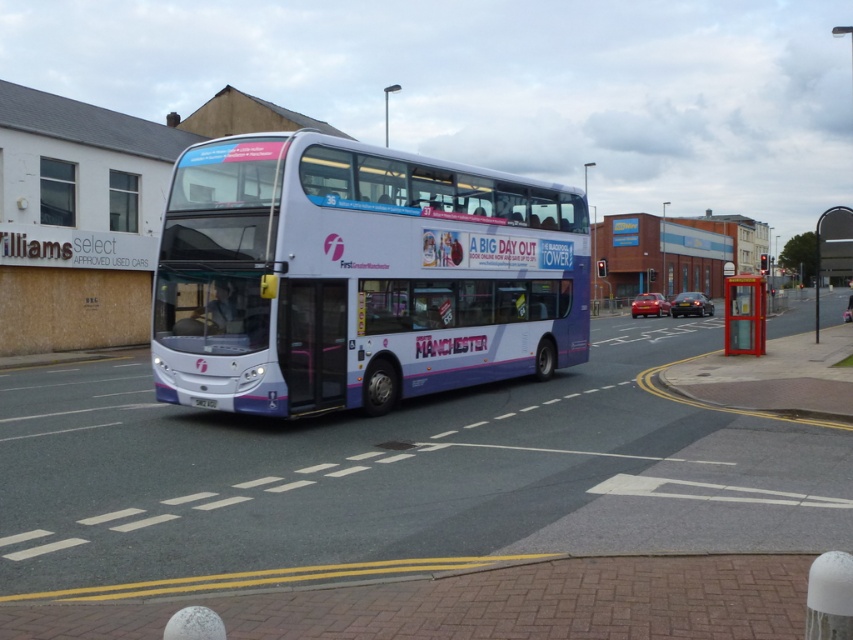
Is white glossy bus at center wider than metallic bus stop at right?

No, white glossy bus at center is not wider than metallic bus stop at right.

Between point (167, 195) and point (849, 236), which one is positioned in front?

Point (167, 195) is in front.

This screenshot has width=853, height=640. In order to click on white glossy bus at center in this screenshot , I will do `click(358, 276)`.

From the picture: Between white glossy bus at center and white plastic license plate at center, which one has less height?

white plastic license plate at center is shorter.

Can you confirm if white glossy bus at center is smaller than white plastic license plate at center?

Incorrect, white glossy bus at center is not smaller in size than white plastic license plate at center.

Is point (291, 193) in front of point (206, 401)?

Yes, it is.

Locate an element on the screen. white glossy bus at center is located at coordinates (358, 276).

Which is more to the right, metallic bus stop at right or white plastic license plate at center?

From the viewer's perspective, metallic bus stop at right appears more on the right side.

You are a GUI agent. You are given a task and a screenshot of the screen. Output one action in this format:
    pyautogui.click(x=<x>, y=<y>)
    Task: Click on the metallic bus stop at right
    
    Given the screenshot: What is the action you would take?
    pyautogui.click(x=833, y=250)

Between point (825, 257) and point (212, 403), which one is positioned in front?

Point (212, 403)

The width and height of the screenshot is (853, 640). Identify the location of metallic bus stop at right. (833, 250).